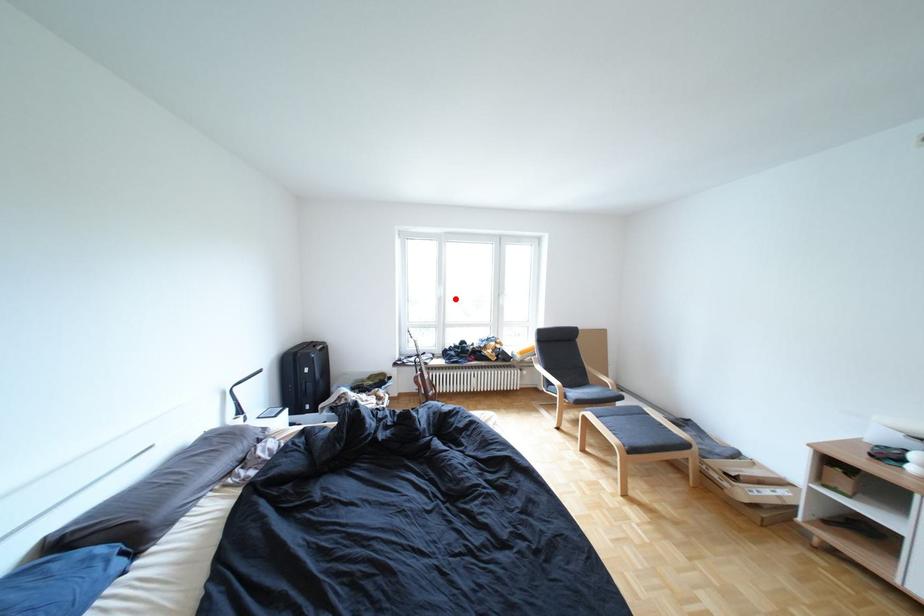
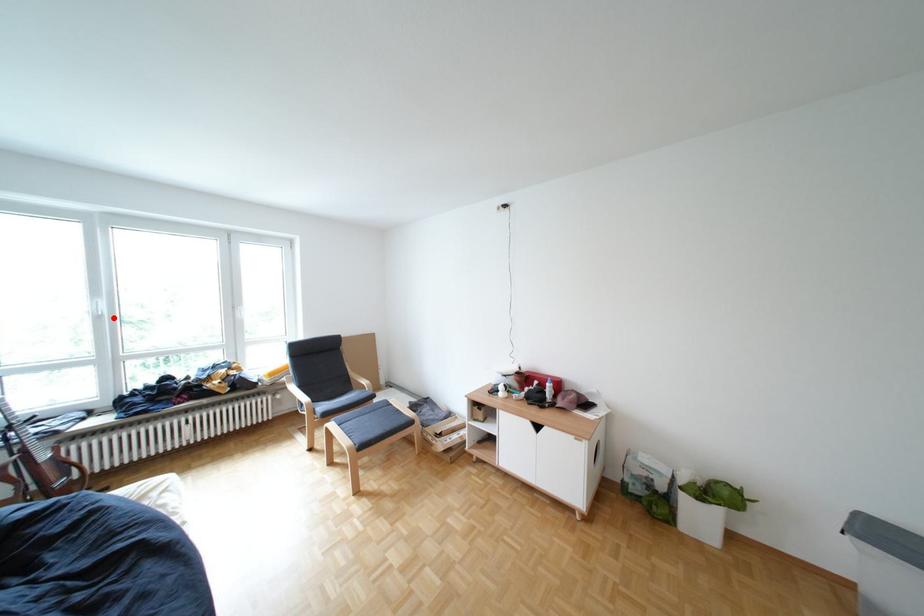
I am providing you with two images of the same scene from different viewpoints. A red point is marked on the first image and another point is marked on the second image. Is the marked point in image1 the same physical position as the marked point in image2?

Yes